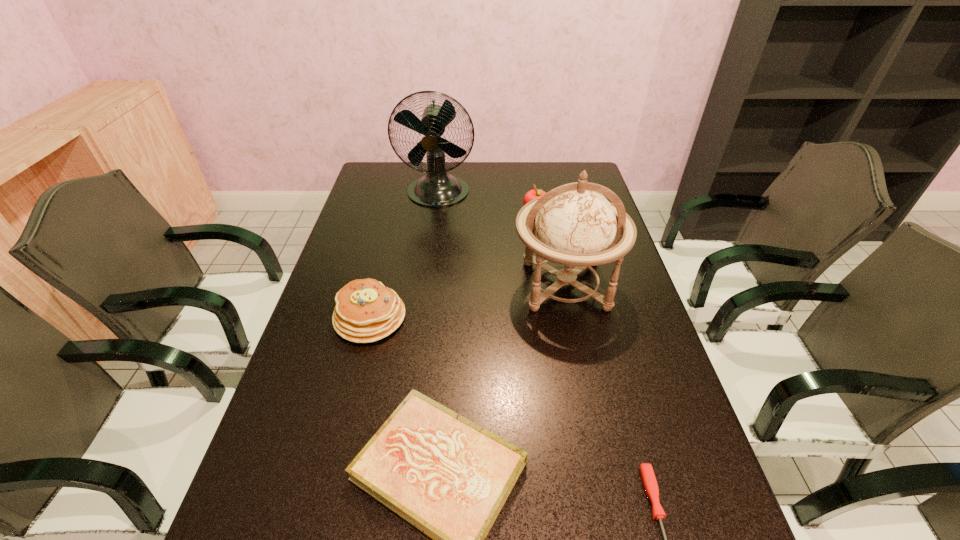
This screenshot has height=540, width=960. In order to click on blank region between the pancake and the fan in this screenshot , I will do `click(404, 255)`.

Select which object appears as the fourth closest to the apple. Please provide its 2D coordinates. Your answer should be formatted as a tuple, i.e. [(x, y)], where the tuple contains the x and y coordinates of a point satisfying the conditions above.

[(447, 476)]

Select which object is the third closest to the apple. Please provide its 2D coordinates. Your answer should be formatted as a tuple, i.e. [(x, y)], where the tuple contains the x and y coordinates of a point satisfying the conditions above.

[(366, 311)]

Find the location of `free space that satisfies the following two spatial constraints: 1. on the front-facing side of the fan; 2. on the left side of the apple`. free space that satisfies the following two spatial constraints: 1. on the front-facing side of the fan; 2. on the left side of the apple is located at coordinates (436, 212).